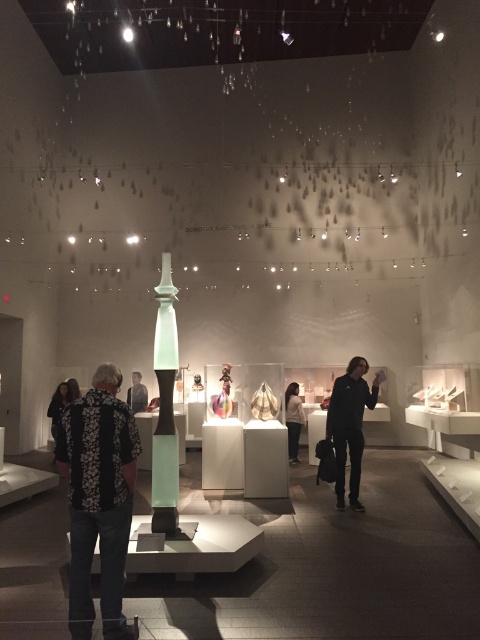
Question: Which object appears farthest from the camera in this image?

Choices:
 (A) black matte jacket at center
 (B) translucent glass column at center

Answer: (A)

Question: Which object appears closest to the camera in this image?

Choices:
 (A) translucent glass column at center
 (B) black matte jacket at center

Answer: (A)

Question: Is black floral shirt at center below dark gray sweater at center?

Choices:
 (A) no
 (B) yes

Answer: (A)

Question: Can you confirm if black matte jacket at center is wider than dark gray sweater at center?

Choices:
 (A) yes
 (B) no

Answer: (A)

Question: Which object is farther from the camera taking this photo?

Choices:
 (A) dark gray sweater at center
 (B) black floral shirt at center
 (C) translucent glass column at center
 (D) black matte jacket at center

Answer: (A)

Question: Does black matte jacket at center come behind white matte jacket at center?

Choices:
 (A) no
 (B) yes

Answer: (A)